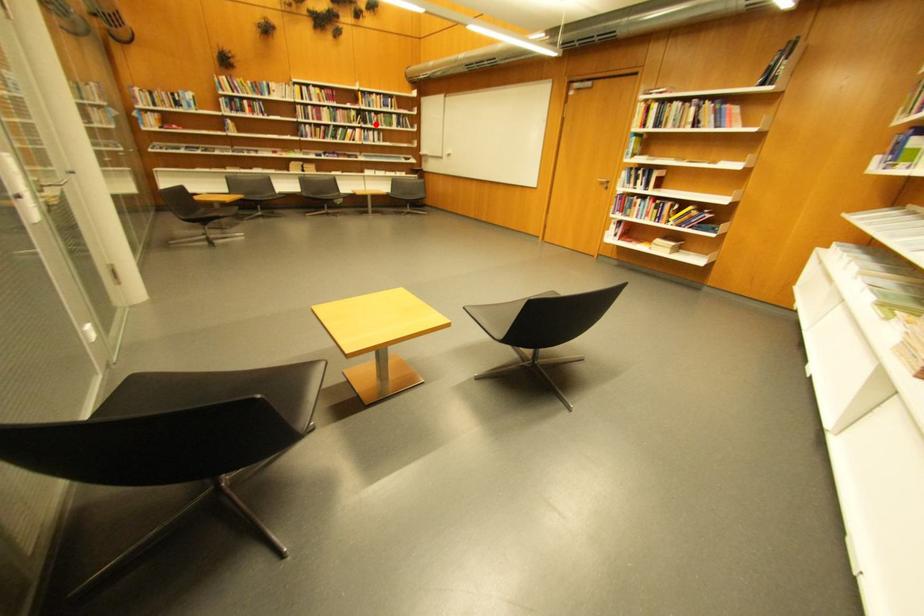
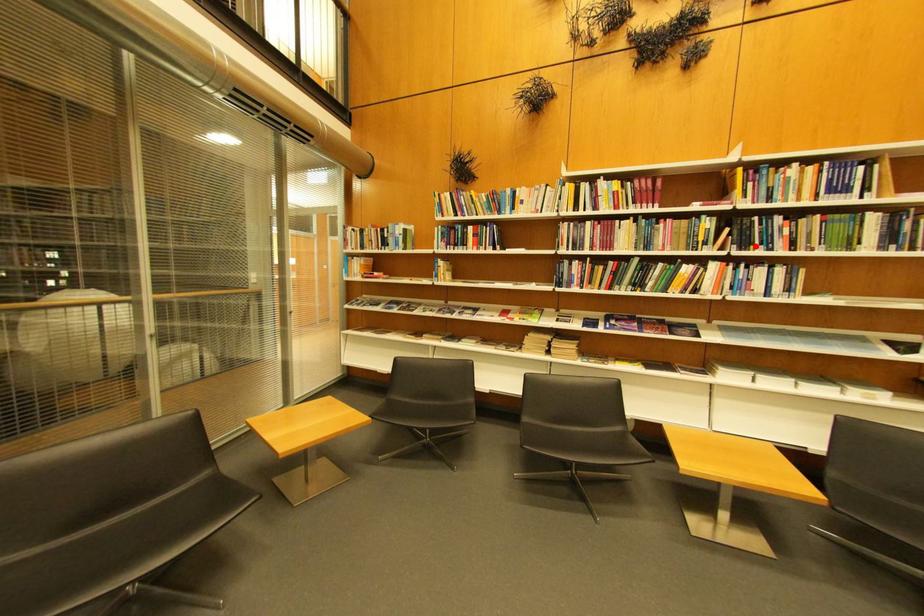
I am providing you with two images of the same scene from different viewpoints. A red point is marked on the first image and another point is marked on the second image. Is the marked point in image1 the same physical position as the marked point in image2?

Yes